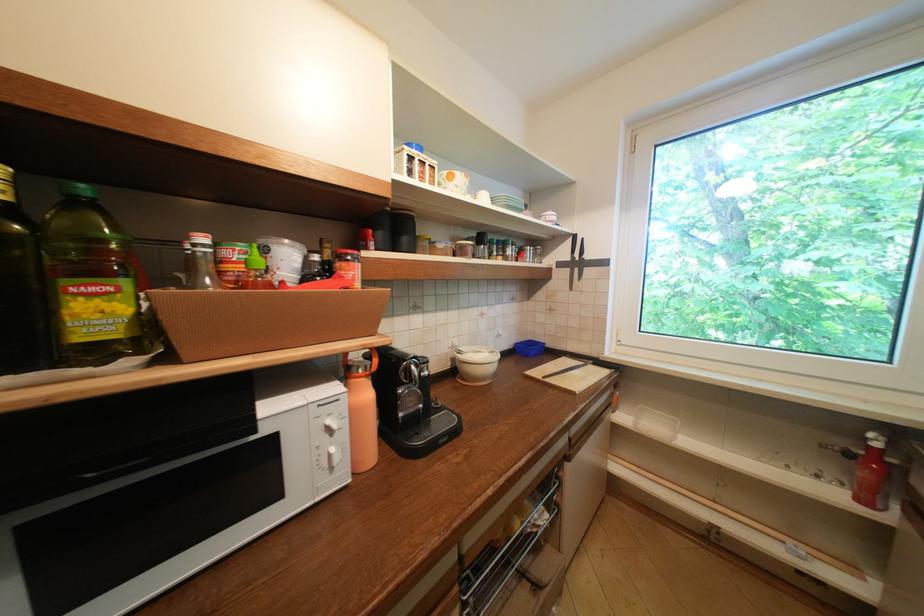
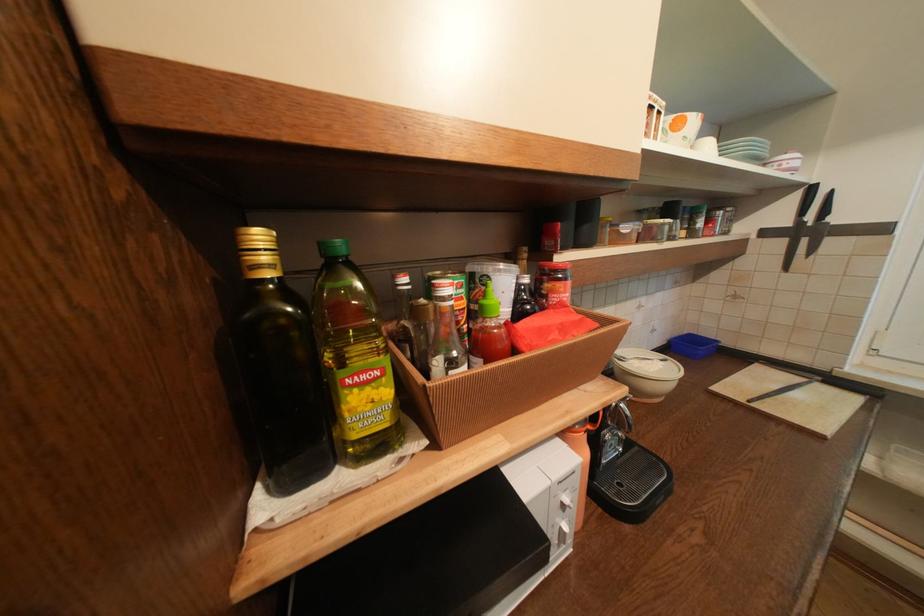
Question: The camera is either moving clockwise (left) or counter-clockwise (right) around the object. The first image is from the beginning of the video and the second image is from the end. Is the camera moving left or right when shooting the video?

Choices:
 (A) Left
 (B) Right

Answer: (B)